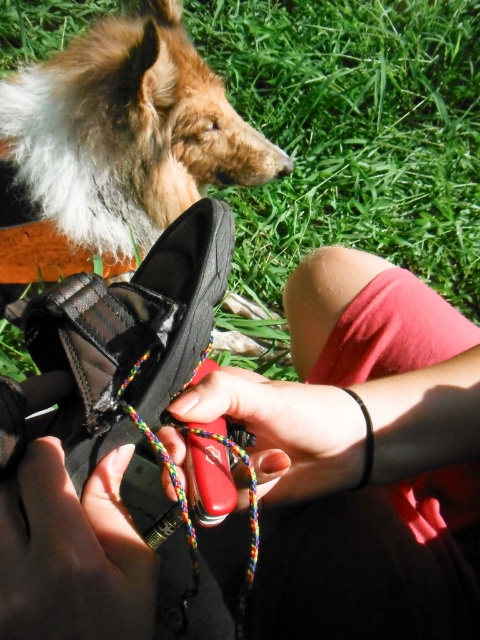
Which is above, matte black shoe at lower left or red matte knife at center?

Positioned higher is red matte knife at center.

Between matte black shoe at lower left and red matte knife at center, which one has less height?

Standing shorter between the two is matte black shoe at lower left.

This screenshot has height=640, width=480. Find the location of `matte black shoe at lower left`. matte black shoe at lower left is located at coordinates pyautogui.click(x=72, y=554).

Describe the element at coordinates (360, 458) in the screenshot. This screenshot has width=480, height=640. I see `rubber shoe at lower center` at that location.

Does rubber shoe at lower center appear over matte black shoe at lower left?

Correct, rubber shoe at lower center is located above matte black shoe at lower left.

What are the coordinates of `rubber shoe at lower center` in the screenshot? It's located at coord(360,458).

Does red matte knife at center appear under black rubber wristband at lower center?

No, red matte knife at center is not below black rubber wristband at lower center.

In the scene shown: Is red matte knife at center further to the viewer compared to black rubber wristband at lower center?

No, it is in front of black rubber wristband at lower center.

You are a GUI agent. You are given a task and a screenshot of the screen. Output one action in this format:
    pyautogui.click(x=<x>, y=<y>)
    Task: Click on the red matte knife at center
    This screenshot has width=480, height=640.
    Given the screenshot: What is the action you would take?
    pyautogui.click(x=285, y=429)